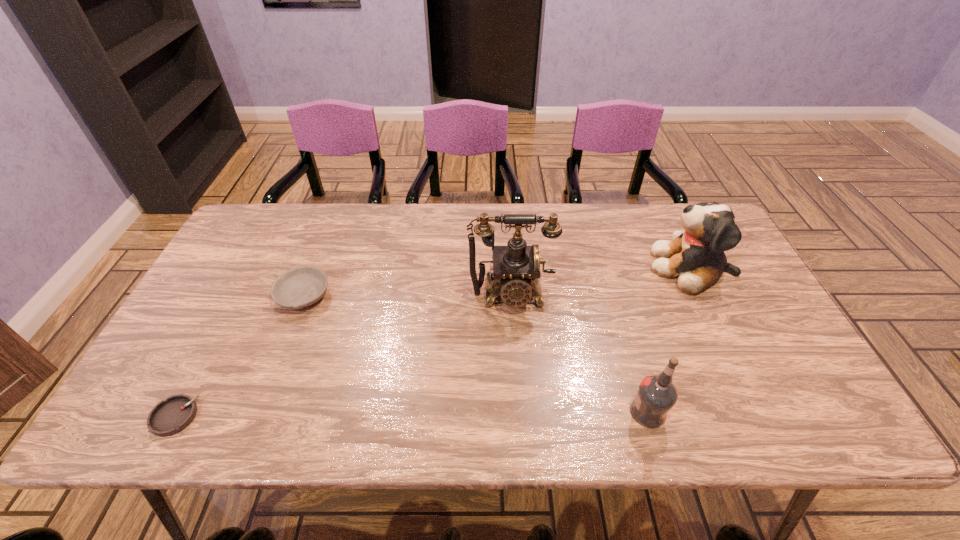
Find the location of `object that is at the left edge`. object that is at the left edge is located at coordinates (171, 416).

You are a GUI agent. You are given a task and a screenshot of the screen. Output one action in this format:
    pyautogui.click(x=<x>, y=<y>)
    Task: Click on the object that is at the right edge
    
    Given the screenshot: What is the action you would take?
    pyautogui.click(x=696, y=257)

Where is `object at the near left corner`? object at the near left corner is located at coordinates (171, 416).

Locate an element on the screen. The width and height of the screenshot is (960, 540). object that is at the far right corner is located at coordinates (696, 257).

Find the location of a particular element. The width and height of the screenshot is (960, 540). vacant space at the far edge is located at coordinates (594, 242).

This screenshot has width=960, height=540. In the image, there is a desktop. What are the coordinates of `vacant space at the near edge` in the screenshot? It's located at (280, 404).

Locate an element on the screen. This screenshot has height=540, width=960. free space at the left edge of the desktop is located at coordinates (x=254, y=291).

In the image, there is a desktop. Where is `vacant space at the near left corner`? vacant space at the near left corner is located at coordinates (201, 411).

I want to click on blank space at the near right corner, so click(x=803, y=413).

Where is `free space between the tallest object and the puppy`? The width and height of the screenshot is (960, 540). free space between the tallest object and the puppy is located at coordinates (601, 281).